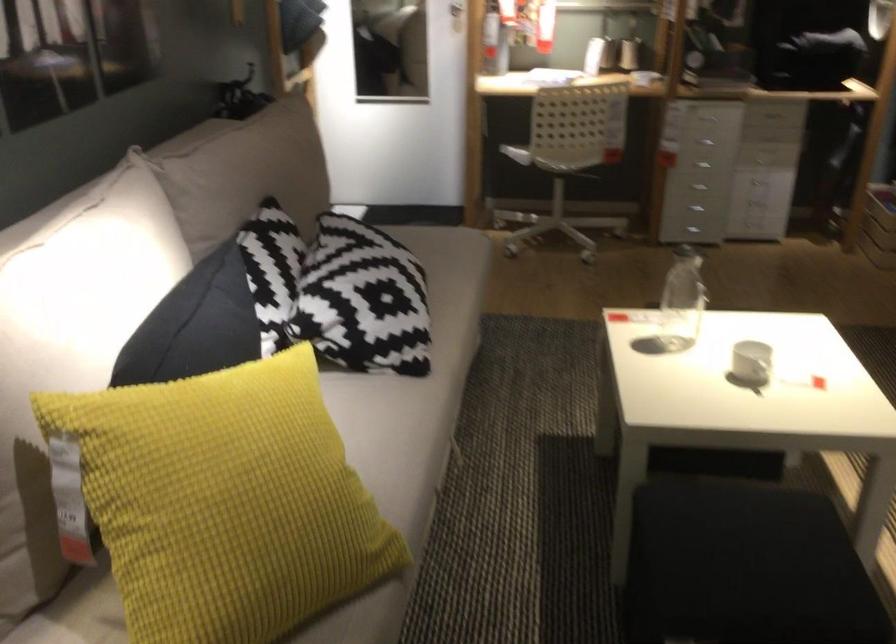
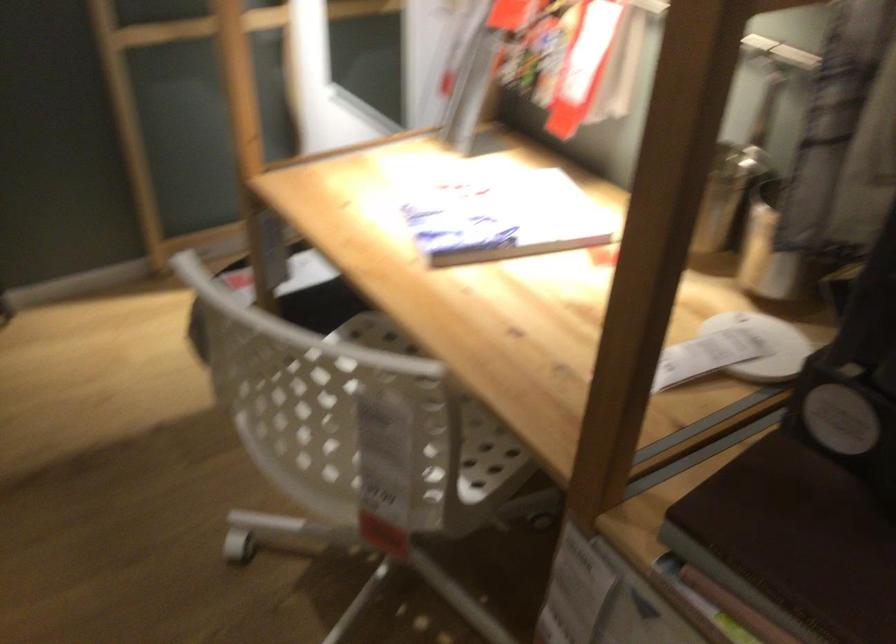
Locate, in the second image, the point that corresponds to [624,97] in the first image.

(371, 418)